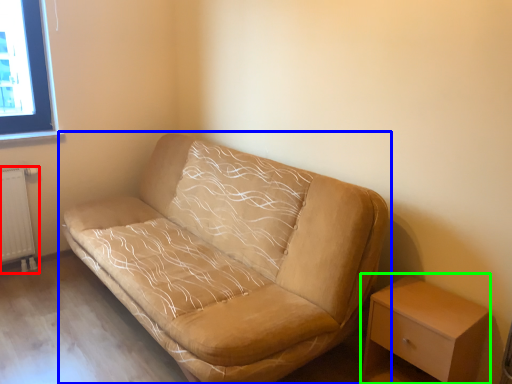
Question: Estimate the real-world distances between objects in this image. Which object is closer to radiator (highlighted by a red box), studio couch (highlighted by a blue box) or table (highlighted by a green box)?

Choices:
 (A) studio couch
 (B) table

Answer: (A)